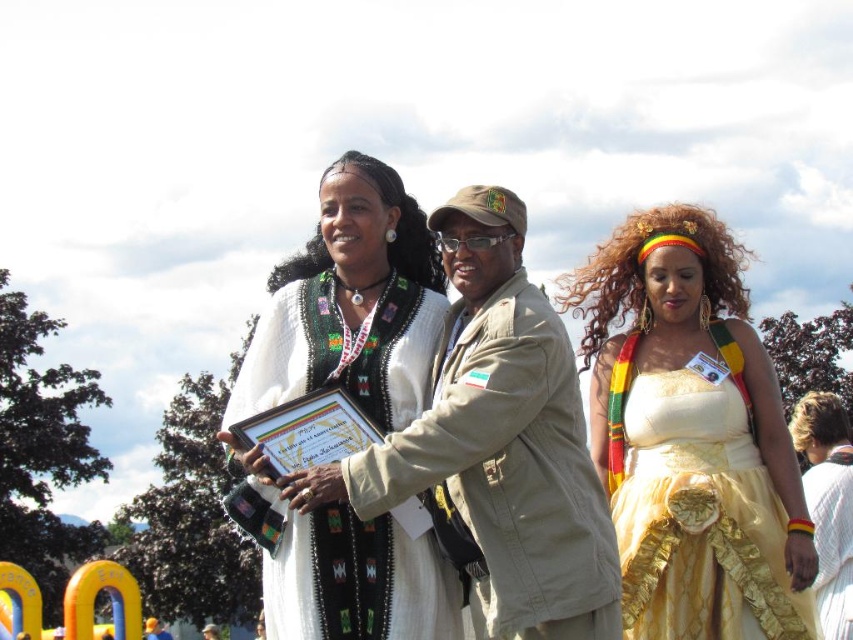
Consider the image. You are a photographer at the event and need to capture a photo of both the gold satin dress at center and the khaki fabric jacket at center in the same frame. Given that your camera has a maximum focus range of 15 meters, will you be able to do so?

The gold satin dress at center is 17.30 meters from the khaki fabric jacket at center, which exceeds the camera maximum focus range of 15 meters, so you cannot capture both in the same frame.